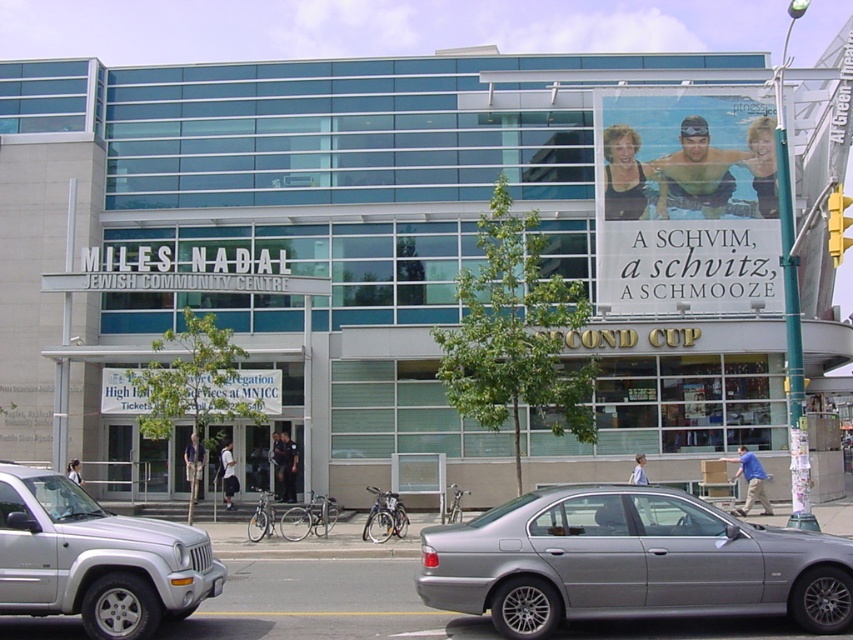
You are a pedestrian standing on the sidewalk in front of the Miles Nadal Jewish Community Centre. You see a silver metallic sedan at center and a matte plastic sign at upper right. Which object is closer to the building?

The silver metallic sedan at center is closer to the building because it is positioned on the left side of the matte plastic sign at upper right, meaning both are in front of the building but the sedan is nearer.

You are a delivery person who needs to park your 1.8 meters tall delivery box next to the silver metallic sedan at center and the silver metallic suv at lower left. Which vehicle should you place the box next to so it doesn

The silver metallic sedan at center has a lesser height compared to the silver metallic suv at lower left. Therefore, the delivery box should be placed next to the silver metallic suv at lower left since its height can accommodate the 1.8 meters tall box without obstruction.

In the scene shown: You are a pedestrian standing on the sidewalk in front of the Miles Nadal Jewish Community Centre. You want to walk from the silver metallic suv at lower left to the matte plastic sign at upper right. Which direction should you move relative to the sign?

The silver metallic suv at lower left is behind the matte plastic sign at upper right, so to reach the sign from the suv, you should move forward towards the matte plastic sign at upper right.